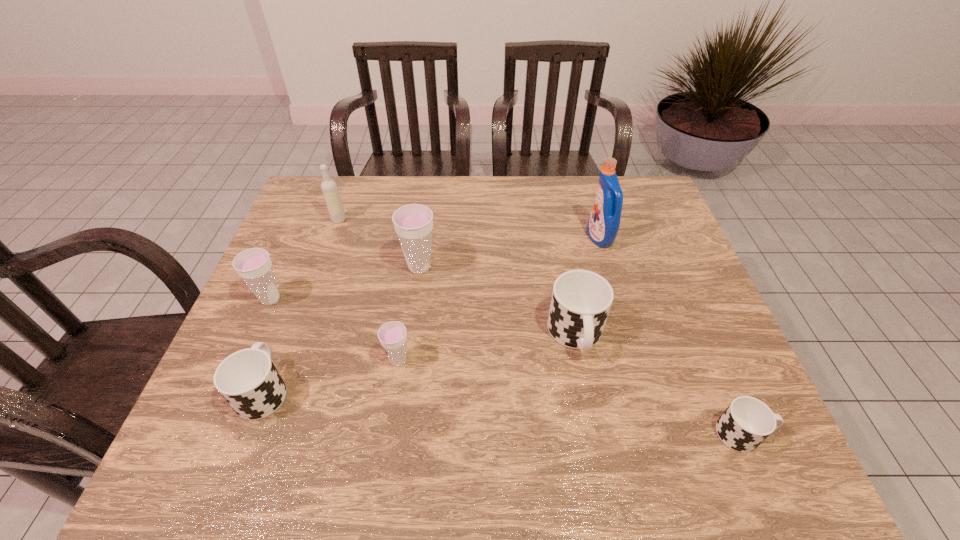
Find the location of a particular element. The image size is (960, 540). the seventh object from left to right is located at coordinates (603, 225).

This screenshot has height=540, width=960. In order to click on the seventh nearest object in this screenshot , I will do `click(603, 225)`.

Where is `vodka`? The image size is (960, 540). vodka is located at coordinates (329, 188).

This screenshot has height=540, width=960. In order to click on white vodka in this screenshot , I will do `click(329, 188)`.

Where is `the tallest cup`? Image resolution: width=960 pixels, height=540 pixels. the tallest cup is located at coordinates (413, 223).

Where is `the third farthest object`? The width and height of the screenshot is (960, 540). the third farthest object is located at coordinates (413, 223).

Identify the location of the second nearest purple cup. (253, 265).

Locate an element on the screen. This screenshot has height=540, width=960. the leftmost purple cup is located at coordinates (253, 265).

Locate an element on the screen. This screenshot has height=540, width=960. the fifth cup from left to right is located at coordinates (581, 300).

I want to click on the second black cup from right to left, so click(x=581, y=300).